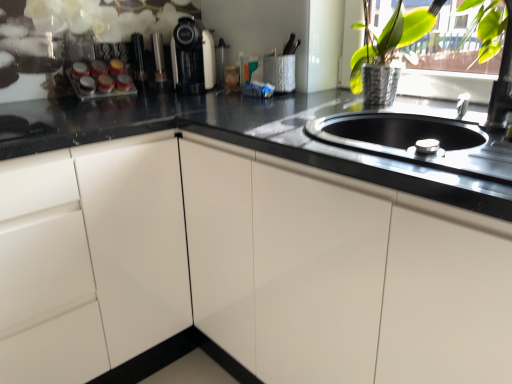
Question: Is metallic silver vase at upper right far away from white glossy cabinet at left?

Choices:
 (A) yes
 (B) no

Answer: (B)

Question: Considering the relative sizes of metallic silver vase at upper right and white glossy cabinet at left in the image provided, is metallic silver vase at upper right taller than white glossy cabinet at left?

Choices:
 (A) yes
 (B) no

Answer: (B)

Question: Is white glossy cabinet at left surrounded by metallic silver vase at upper right?

Choices:
 (A) yes
 (B) no

Answer: (B)

Question: Considering the relative sizes of metallic silver vase at upper right and white glossy cabinet at left in the image provided, is metallic silver vase at upper right wider than white glossy cabinet at left?

Choices:
 (A) yes
 (B) no

Answer: (B)

Question: From a real-world perspective, is metallic silver vase at upper right positioned over white glossy cabinet at left based on gravity?

Choices:
 (A) no
 (B) yes

Answer: (B)

Question: From the image's perspective, relative to metallic silver vase at upper right, is white glossy cabinet at left above or below?

Choices:
 (A) below
 (B) above

Answer: (A)

Question: Considering their positions, is white glossy cabinet at left located in front of or behind metallic silver vase at upper right?

Choices:
 (A) behind
 (B) front

Answer: (B)

Question: Considering the relative positions of white glossy cabinet at left and metallic silver vase at upper right in the image provided, is white glossy cabinet at left to the left or to the right of metallic silver vase at upper right?

Choices:
 (A) left
 (B) right

Answer: (A)

Question: From a real-world perspective, is white glossy cabinet at left positioned above or below metallic silver vase at upper right?

Choices:
 (A) above
 (B) below

Answer: (B)

Question: Is white glossy cabinet at left situated inside matte black coffee machine at upper center or outside?

Choices:
 (A) inside
 (B) outside

Answer: (B)

Question: Is point (129, 281) positioned closer to the camera than point (210, 79)?

Choices:
 (A) farther
 (B) closer

Answer: (B)

Question: Considering their positions, is white glossy cabinet at left located in front of or behind matte black coffee machine at upper center?

Choices:
 (A) behind
 (B) front

Answer: (B)

Question: In terms of width, does white glossy cabinet at left look wider or thinner when compared to matte black coffee machine at upper center?

Choices:
 (A) wide
 (B) thin

Answer: (A)

Question: Is matte black coffee machine at upper center inside or outside of white glossy cabinet at left?

Choices:
 (A) inside
 (B) outside

Answer: (B)

Question: In the image, is matte black coffee machine at upper center positioned in front of or behind white glossy cabinet at left?

Choices:
 (A) front
 (B) behind

Answer: (B)